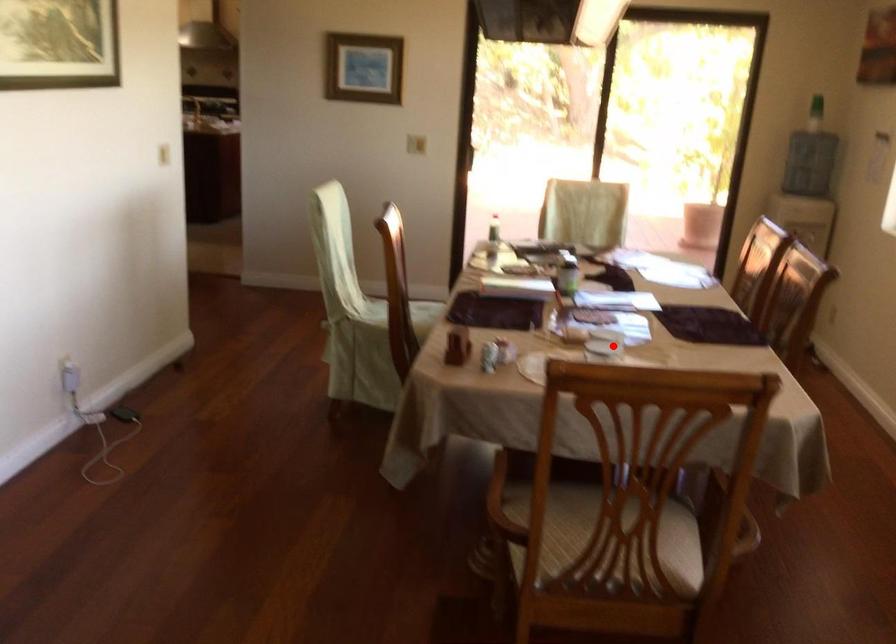
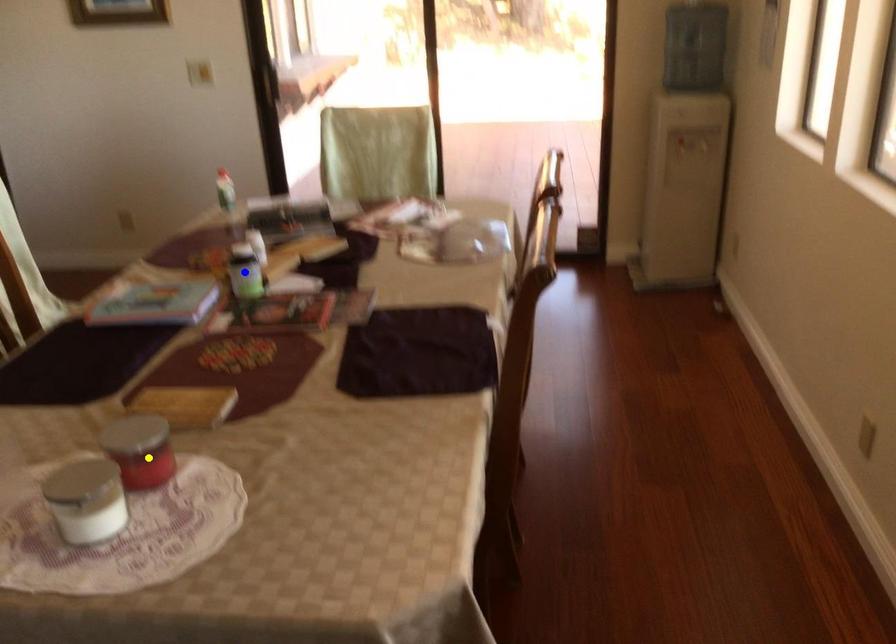
Question: I am providing you with two images of the same scene from different viewpoints. A red point is marked on the first image. You are given multiple points on the second image. Which mark in image 2 goes with the point in image 1?

Choices:
 (A) yellow point
 (B) green point
 (C) blue point

Answer: (A)